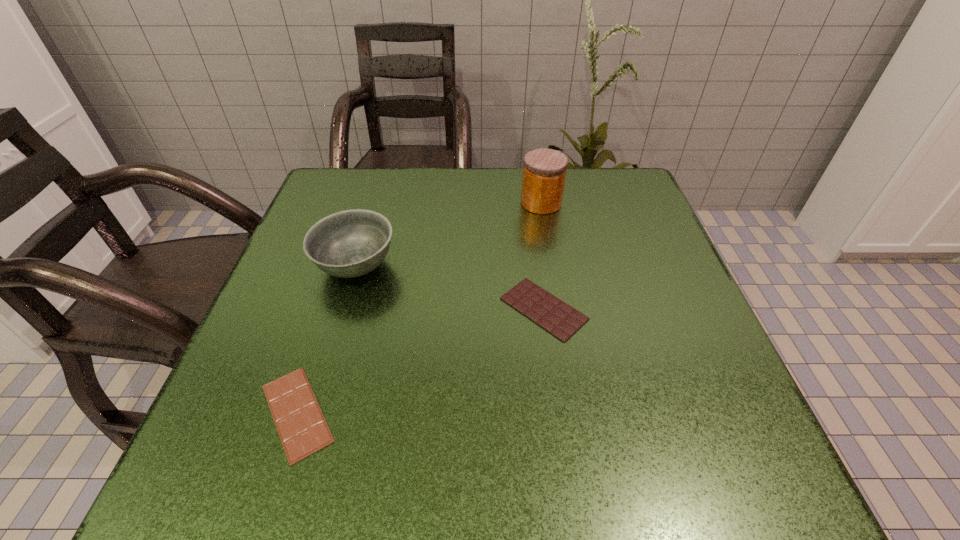
You are a GUI agent. You are given a task and a screenshot of the screen. Output one action in this format:
    pyautogui.click(x=<x>, y=<y>)
    Task: Click on the tallest object
    
    Given the screenshot: What is the action you would take?
    pyautogui.click(x=544, y=172)

Identify the location of the farthest object. Image resolution: width=960 pixels, height=540 pixels. (544, 172).

Where is `bowl`? Image resolution: width=960 pixels, height=540 pixels. bowl is located at coordinates (351, 243).

Where is `the farther chocolate bar`? The image size is (960, 540). the farther chocolate bar is located at coordinates (561, 320).

This screenshot has width=960, height=540. In order to click on the left chocolate bar in this screenshot , I will do `click(302, 428)`.

Identify the location of the nearest object. (302, 428).

This screenshot has width=960, height=540. In order to click on vacant space located 0.150m on the front of the tallest object in this screenshot , I will do `click(550, 257)`.

You are a GUI agent. You are given a task and a screenshot of the screen. Output one action in this format:
    pyautogui.click(x=<x>, y=<y>)
    Task: Click on the vacant space located 0.220m on the back of the bowl
    This screenshot has width=960, height=540.
    Given the screenshot: What is the action you would take?
    pyautogui.click(x=380, y=185)

Locate an element on the screen. vacant space situated on the right of the farther chocolate bar is located at coordinates (646, 309).

Find the location of a particular element. This screenshot has height=540, width=960. vacant area situated 0.050m on the left of the left chocolate bar is located at coordinates (219, 413).